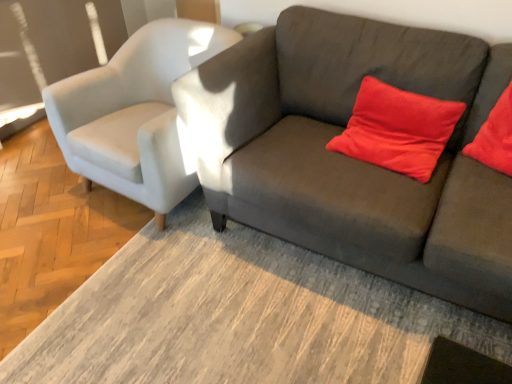
Question: Is satin red pillow at upper right directly adjacent to satin white armchair at left?

Choices:
 (A) no
 (B) yes

Answer: (A)

Question: Is satin red pillow at upper right aimed at satin white armchair at left?

Choices:
 (A) yes
 (B) no

Answer: (B)

Question: From a real-world perspective, is satin red pillow at upper right located higher than satin white armchair at left?

Choices:
 (A) yes
 (B) no

Answer: (A)

Question: Is satin red pillow at upper right outside of satin white armchair at left?

Choices:
 (A) yes
 (B) no

Answer: (A)

Question: Considering the relative sizes of satin red pillow at upper right and satin white armchair at left in the image provided, is satin red pillow at upper right shorter than satin white armchair at left?

Choices:
 (A) yes
 (B) no

Answer: (A)

Question: Considering the positions of point tap(413, 178) and point tap(224, 213), is point tap(413, 178) closer or farther from the camera than point tap(224, 213)?

Choices:
 (A) closer
 (B) farther

Answer: (A)

Question: From a real-world perspective, is satin red pillow at upper right above or below dark gray fabric couch at center?

Choices:
 (A) above
 (B) below

Answer: (A)

Question: Considering their positions, is satin red pillow at upper right located in front of or behind dark gray fabric couch at center?

Choices:
 (A) behind
 (B) front

Answer: (A)

Question: Is satin red pillow at upper right situated inside dark gray fabric couch at center or outside?

Choices:
 (A) outside
 (B) inside

Answer: (B)

Question: Which is correct: satin red pillow at upper right is inside satin white armchair at left, or outside of it?

Choices:
 (A) outside
 (B) inside

Answer: (A)

Question: From the image's perspective, relative to satin white armchair at left, is satin red pillow at upper right above or below?

Choices:
 (A) above
 (B) below

Answer: (B)

Question: From a real-world perspective, is satin red pillow at upper right positioned above or below satin white armchair at left?

Choices:
 (A) below
 (B) above

Answer: (B)

Question: In the image, is satin red pillow at upper right positioned in front of or behind satin white armchair at left?

Choices:
 (A) behind
 (B) front

Answer: (B)

Question: In terms of width, does dark gray fabric couch at center look wider or thinner when compared to satin white armchair at left?

Choices:
 (A) wide
 (B) thin

Answer: (A)

Question: In terms of size, does dark gray fabric couch at center appear bigger or smaller than satin white armchair at left?

Choices:
 (A) small
 (B) big

Answer: (B)